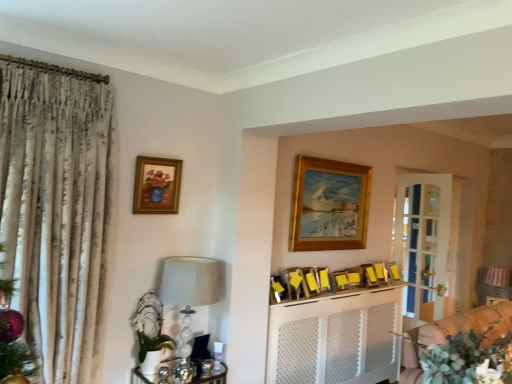
Measure the distance between point (368, 283) and camera.

Point (368, 283) and camera are 12.39 feet apart.

What do you see at coordinates (336, 338) in the screenshot? I see `white perforated cabinet at center` at bounding box center [336, 338].

Measure the distance between point (391, 263) and camera.

The distance of point (391, 263) from camera is 14.15 feet.

Identify the location of shiny metallic tray at lower center, which ranks as the second furniture in back-to-front order. The height and width of the screenshot is (384, 512). (213, 378).

Considering the sizes of objects yellow paper at center, positioned as the 7th picture frame in right-to-left order, and white textured cabinet at center, placed as the 2th furniture when sorted from right to left, in the image provided, who is thinner, yellow paper at center, positioned as the 7th picture frame in right-to-left order, or white textured cabinet at center, placed as the 2th furniture when sorted from right to left,?

Thinner between the two is yellow paper at center, positioned as the 7th picture frame in right-to-left order.

Is yellow paper at center, positioned as the 7th picture frame in right-to-left order, shorter than white textured cabinet at center, placed as the 2th furniture when sorted from right to left?

Correct, yellow paper at center, positioned as the 7th picture frame in right-to-left order, is not as tall as white textured cabinet at center, placed as the 2th furniture when sorted from right to left.

From the image's perspective, which is above, yellow paper at center, placed as the 3th picture frame when sorted from left to right, or white textured cabinet at center, acting as the 1th furniture starting from the front?

yellow paper at center, placed as the 3th picture frame when sorted from left to right, from the image's perspective.

From a real-world perspective, is yellow paper at center, positioned as the 7th picture frame in right-to-left order, positioned above or below white textured cabinet at center, placed as the 2th furniture when sorted from right to left?

Clearly, from a real-world perspective, yellow paper at center, positioned as the 7th picture frame in right-to-left order, is above white textured cabinet at center, placed as the 2th furniture when sorted from right to left.

Can you see gold wooden picture frame at upper center, which is the fifth picture frame from left to right, touching yellow paper at center, the 2th picture frame viewed from the left?

There is a gap between gold wooden picture frame at upper center, which is the fifth picture frame from left to right, and yellow paper at center, the 2th picture frame viewed from the left.

Consider the image. Is gold wooden picture frame at upper center, which is the fifth picture frame in right-to-left order, to the right of yellow paper at center, positioned as the eighth picture frame in right-to-left order, from the viewer's perspective?

Yes.

Can you tell me how much gold wooden picture frame at upper center, which is the fifth picture frame from left to right, and yellow paper at center, positioned as the eighth picture frame in right-to-left order, differ in facing direction?

They differ by 21 degrees in their facing directions.

Considering the sizes of objects shiny metallic tray at lower center, which ranks as the second furniture in back-to-front order, and wooden picture frame at center, the sixth picture frame from the right, in the image provided, who is bigger, shiny metallic tray at lower center, which ranks as the second furniture in back-to-front order, or wooden picture frame at center, the sixth picture frame from the right,?

shiny metallic tray at lower center, which ranks as the second furniture in back-to-front order, is bigger.

Does point (214, 383) come farther from viewer compared to point (323, 276)?

No, it is not.

In the scene shown: Is shiny metallic tray at lower center, the first furniture from the left, next to wooden picture frame at center, the sixth picture frame from the right?

No, shiny metallic tray at lower center, the first furniture from the left, is not in contact with wooden picture frame at center, the sixth picture frame from the right.

From a real-world perspective, is shiny metallic tray at lower center, which ranks as the third furniture in right-to-left order, positioned above or below wooden picture frame at center, which is the 4th picture frame in left-to-right order?

Clearly, from a real-world perspective, shiny metallic tray at lower center, which ranks as the third furniture in right-to-left order, is below wooden picture frame at center, which is the 4th picture frame in left-to-right order.

Based on the photo, from the image's perspective, who appears lower, wooden picture frame at center, marked as the 4th picture frame in a right-to-left arrangement, or wooden frame with floral painting at upper left, the ninth picture frame viewed from the right?

wooden picture frame at center, marked as the 4th picture frame in a right-to-left arrangement, appears lower in the image.

Does point (344, 285) lie in front of point (145, 174)?

No, (344, 285) is further to viewer.

Can you confirm if wooden picture frame at center, marked as the 4th picture frame in a right-to-left arrangement, is positioned to the right of wooden frame with floral painting at upper left, the ninth picture frame viewed from the right?

Indeed, wooden picture frame at center, marked as the 4th picture frame in a right-to-left arrangement, is positioned on the right side of wooden frame with floral painting at upper left, the ninth picture frame viewed from the right.

Consider the image. From a real-world perspective, is wooden picture frame at center, marked as the 4th picture frame in a right-to-left arrangement, over wooden frame with floral painting at upper left, the ninth picture frame viewed from the right?

No.

Which is farther from the camera, (303, 271) or (281, 297)?

Point (303, 271)

Consider the image. Does yellow paper at center, positioned as the 7th picture frame in right-to-left order, lie behind yellow paper at center, positioned as the eighth picture frame in right-to-left order?

Yes.

Between yellow paper at center, positioned as the 7th picture frame in right-to-left order, and yellow paper at center, the 2th picture frame viewed from the left, which one appears on the right side from the viewer's perspective?

From the viewer's perspective, yellow paper at center, positioned as the 7th picture frame in right-to-left order, appears more on the right side.

Is yellow paper at center, placed as the 3th picture frame when sorted from left to right, inside or outside of yellow paper at center, the 2th picture frame viewed from the left?

yellow paper at center, placed as the 3th picture frame when sorted from left to right, is not enclosed by yellow paper at center, the 2th picture frame viewed from the left.

Is gold wooden picture frame at upper center, which is the fifth picture frame in right-to-left order, positioned with its back to wooden picture frame at center, placed as the 3th picture frame when sorted from right to left?

No, wooden picture frame at center, placed as the 3th picture frame when sorted from right to left, is not at the back of gold wooden picture frame at upper center, which is the fifth picture frame in right-to-left order.

Which object is positioned more to the left, gold wooden picture frame at upper center, which is the fifth picture frame in right-to-left order, or wooden picture frame at center, marked as the seventh picture frame in a left-to-right arrangement?

Positioned to the left is gold wooden picture frame at upper center, which is the fifth picture frame in right-to-left order.

Which object is further away from the camera, gold wooden picture frame at upper center, which is the fifth picture frame from left to right, or wooden picture frame at center, marked as the seventh picture frame in a left-to-right arrangement?

wooden picture frame at center, marked as the seventh picture frame in a left-to-right arrangement.

Can you confirm if gold wooden picture frame at upper center, which is the fifth picture frame from left to right, is shorter than wooden picture frame at center, placed as the 3th picture frame when sorted from right to left?

In fact, gold wooden picture frame at upper center, which is the fifth picture frame from left to right, may be taller than wooden picture frame at center, placed as the 3th picture frame when sorted from right to left.

Considering the positions of objects wooden picture frame at upper center, the first picture frame from the right, and white textured cabinet at center, the 2th furniture when ordered from left to right, in the image provided, who is behind, wooden picture frame at upper center, the first picture frame from the right, or white textured cabinet at center, the 2th furniture when ordered from left to right,?

wooden picture frame at upper center, the first picture frame from the right, is further from the camera.

There is a white textured cabinet at center, the 2th furniture when ordered from left to right. Where is `the 1st picture frame above it (from a real-world perspective)`? The height and width of the screenshot is (384, 512). the 1st picture frame above it (from a real-world perspective) is located at coordinates (393, 271).

Which object is thinner, wooden picture frame at upper center, the first picture frame from the right, or white textured cabinet at center, positioned as the 3th furniture in back-to-front order?

wooden picture frame at upper center, the first picture frame from the right, is thinner.

Between wooden picture frame at upper center, placed as the ninth picture frame when sorted from left to right, and white textured cabinet at center, acting as the 1th furniture starting from the front, which one appears on the right side from the viewer's perspective?

From the viewer's perspective, wooden picture frame at upper center, placed as the ninth picture frame when sorted from left to right, appears more on the right side.

The width and height of the screenshot is (512, 384). There is a white textured cabinet at center, acting as the 1th furniture starting from the front. In order to click on the 4th picture frame above it (from a real-world perspective) in this screenshot , I will do `click(310, 282)`.

Identify the location of picture frame that is the 2nd object located behind the yellow paper at center, positioned as the eighth picture frame in right-to-left order. The width and height of the screenshot is (512, 384). (329, 205).

When comparing their distances from wooden picture frame at center, which is the 4th picture frame in left-to-right order, does white perforated cabinet at center or shiny metallic tray at lower center, placed as the second furniture when sorted from front to back, seem further?

shiny metallic tray at lower center, placed as the second furniture when sorted from front to back.

When comparing their distances from wooden picture frame at upper center, the eighth picture frame when ordered from left to right, does wooden picture frame at center, which is the 4th picture frame in left-to-right order, or wooden picture frame at center, marked as the seventh picture frame in a left-to-right arrangement, seem further?

Based on the image, wooden picture frame at center, which is the 4th picture frame in left-to-right order, appears to be further to wooden picture frame at upper center, the eighth picture frame when ordered from left to right.

From the image, which object appears to be nearer to wooden frame with floral painting at upper left, the ninth picture frame viewed from the right, shiny metallic tray at lower center, the first furniture from the left, or gold wooden picture frame at upper center, which is the fifth picture frame from left to right?

Based on the image, shiny metallic tray at lower center, the first furniture from the left, appears to be nearer to wooden frame with floral painting at upper left, the ninth picture frame viewed from the right.

From the picture: From the image, which object appears to be nearer to wooden picture frame at center, marked as the 4th picture frame in a right-to-left arrangement, matte glass lamp at left or shiny metallic tray at lower center, which ranks as the third furniture in right-to-left order?

shiny metallic tray at lower center, which ranks as the third furniture in right-to-left order, is closer to wooden picture frame at center, marked as the 4th picture frame in a right-to-left arrangement.

Which object lies further to the anchor point wooden picture frame at upper center, placed as the ninth picture frame when sorted from left to right, wooden picture frame at center, the sixth picture frame from the right, or matte glass lamp at left?

matte glass lamp at left is positioned further to the anchor wooden picture frame at upper center, placed as the ninth picture frame when sorted from left to right.

Looking at the image, which one is located closer to striped fabric cushion at right, positioned as the 3th furniture in front-to-back order, wooden frame with floral painting at upper left, the 1th picture frame positioned from the left, or yellow paper at center, positioned as the 7th picture frame in right-to-left order?

yellow paper at center, positioned as the 7th picture frame in right-to-left order, lies closer to striped fabric cushion at right, positioned as the 3th furniture in front-to-back order, than the other object.

Which object lies nearer to the anchor point yellow paper at center, positioned as the 7th picture frame in right-to-left order, white perforated cabinet at center or wooden picture frame at upper center, the 2th picture frame positioned from the right?

white perforated cabinet at center lies closer to yellow paper at center, positioned as the 7th picture frame in right-to-left order, than the other object.

When comparing their distances from wooden picture frame at upper center, placed as the ninth picture frame when sorted from left to right, does gold wooden picture frame at upper center, which is the fifth picture frame in right-to-left order, or yellow paper at center, positioned as the eighth picture frame in right-to-left order, seem closer?

Among the two, gold wooden picture frame at upper center, which is the fifth picture frame in right-to-left order, is located nearer to wooden picture frame at upper center, placed as the ninth picture frame when sorted from left to right.

Identify the location of entertainment center between yellow paper at center, the 2th picture frame viewed from the left, and striped fabric cushion at right, which is the first furniture in right-to-left order, from left to right. (336, 338).

Identify the location of entertainment center between white textured cabinet at center, placed as the 2th furniture when sorted from right to left, and wooden picture frame at center, marked as the seventh picture frame in a left-to-right arrangement, along the z-axis. Image resolution: width=512 pixels, height=384 pixels. (336, 338).

Find the location of a particular element. The width and height of the screenshot is (512, 384). entertainment center between wooden frame with floral painting at upper left, the 1th picture frame positioned from the left, and wooden picture frame at center, positioned as the sixth picture frame in left-to-right order, from left to right is located at coordinates (336, 338).

You are a GUI agent. You are given a task and a screenshot of the screen. Output one action in this format:
    pyautogui.click(x=<x>, y=<y>)
    Task: Click on the lamp positioned between white textured cabinet at center, the 2th furniture when ordered from left to right, and wooden picture frame at center, marked as the seventh picture frame in a left-to-right arrangement, from near to far
    The image size is (512, 384).
    Given the screenshot: What is the action you would take?
    pyautogui.click(x=190, y=294)